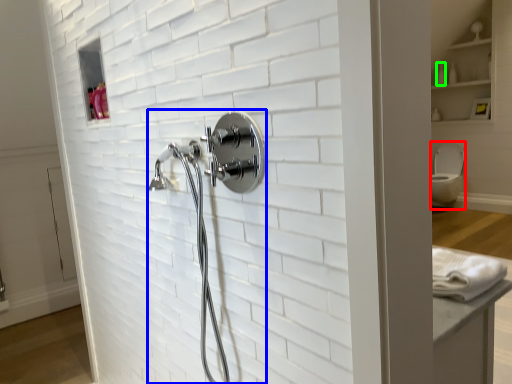
Question: Estimate the real-world distances between objects in this image. Which object is closer to toilet bowl (highlighted by a red box), shower (highlighted by a blue box) or toiletry (highlighted by a green box)?

Choices:
 (A) shower
 (B) toiletry

Answer: (B)